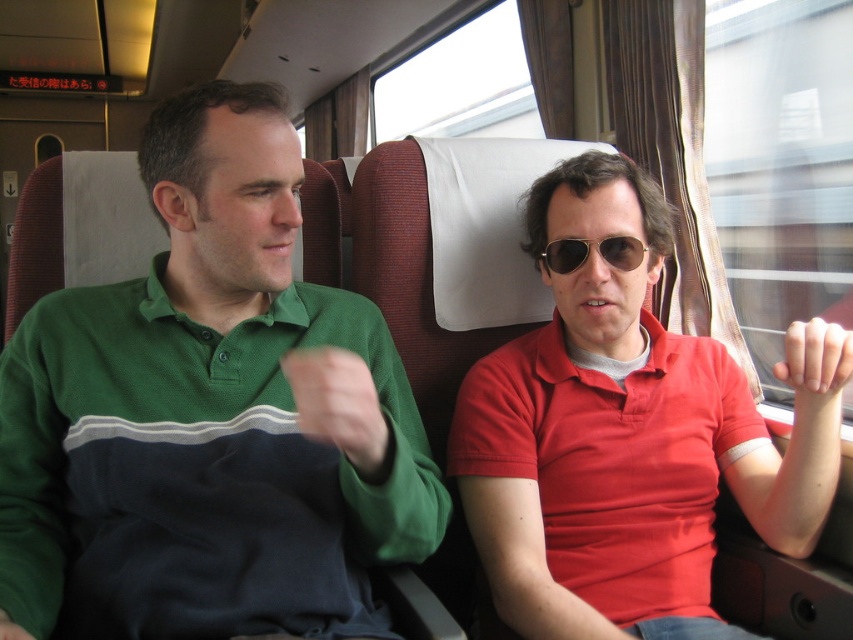
You are standing outside the train carriage and looking through the window. There is a matte red polo shirt at center. Where would you see it located in the image?

The matte red polo shirt at center is located at the coordinates point (619, 440) in the image.

Consider the image. You are a fashion designer observing the two items in the train carriage. Which item has a greater width between the matte red polo shirt at center and the metallic aviator sunglasses at center?

The matte red polo shirt at center has a greater width than the metallic aviator sunglasses at center.